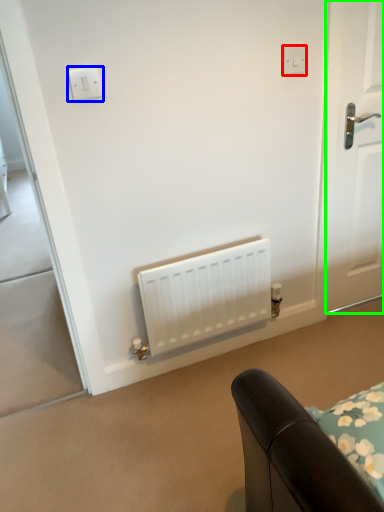
Question: Considering the real-world distances, which object is farthest from electric outlet (highlighted by a red box)? light switch (highlighted by a blue box) or door (highlighted by a green box)?

Choices:
 (A) light switch
 (B) door

Answer: (A)